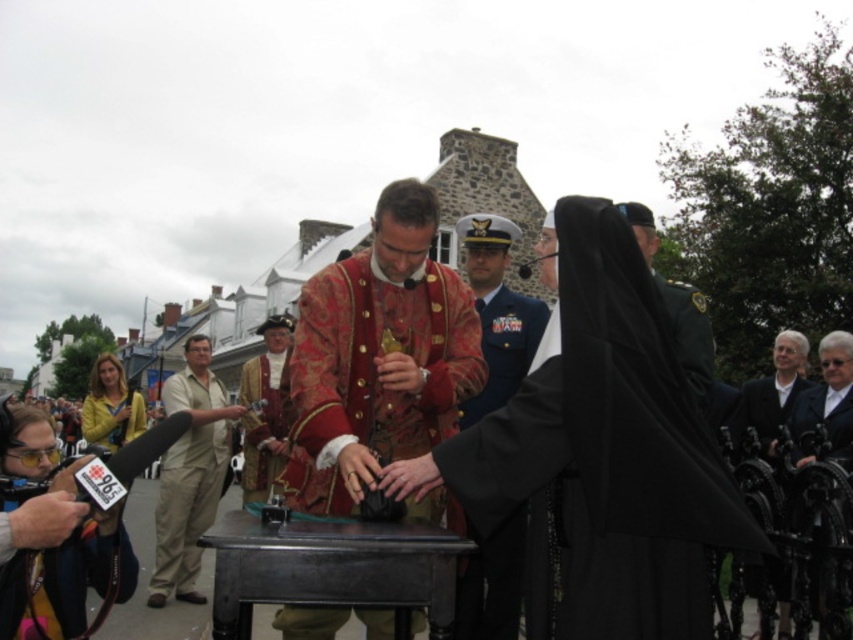
Measure the distance between shiny gold brocade coat at center and camera.

shiny gold brocade coat at center and camera are 177.20 feet apart from each other.

Does point (434, 230) come farther from viewer compared to point (689, 324)?

No.

Does point (445, 360) come farther from viewer compared to point (705, 323)?

No, (445, 360) is closer to viewer.

Locate an element on the screen. Image resolution: width=853 pixels, height=640 pixels. shiny gold brocade coat at center is located at coordinates [x=378, y=356].

Is shiny gold brocade coat at center taller than yellow sweater at left?

Yes, shiny gold brocade coat at center is taller than yellow sweater at left.

Does shiny gold brocade coat at center have a larger size compared to yellow sweater at left?

Actually, shiny gold brocade coat at center might be smaller than yellow sweater at left.

Is point (381, 189) positioned in front of point (125, 387)?

No, (381, 189) is behind (125, 387).

The image size is (853, 640). Find the location of `shiny gold brocade coat at center`. shiny gold brocade coat at center is located at coordinates (378, 356).

Is black matte robe at center shorter than black leather jacket at right?

No, black matte robe at center is not shorter than black leather jacket at right.

Describe the element at coordinates (607, 454) in the screenshot. I see `black matte robe at center` at that location.

This screenshot has width=853, height=640. I want to click on black matte robe at center, so click(x=607, y=454).